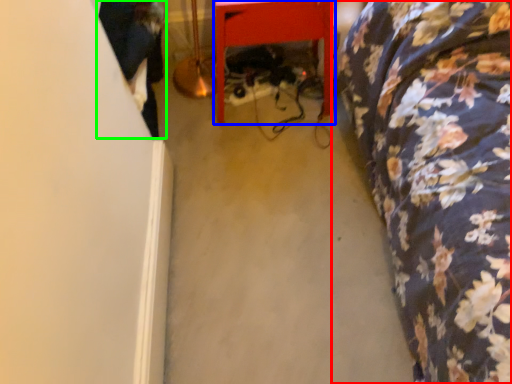
Question: Based on their relative distances, which object is nearer to furniture (highlighted by a red box)? Choose from furniture (highlighted by a blue box) and couple (highlighted by a green box).

Choices:
 (A) furniture
 (B) couple

Answer: (A)